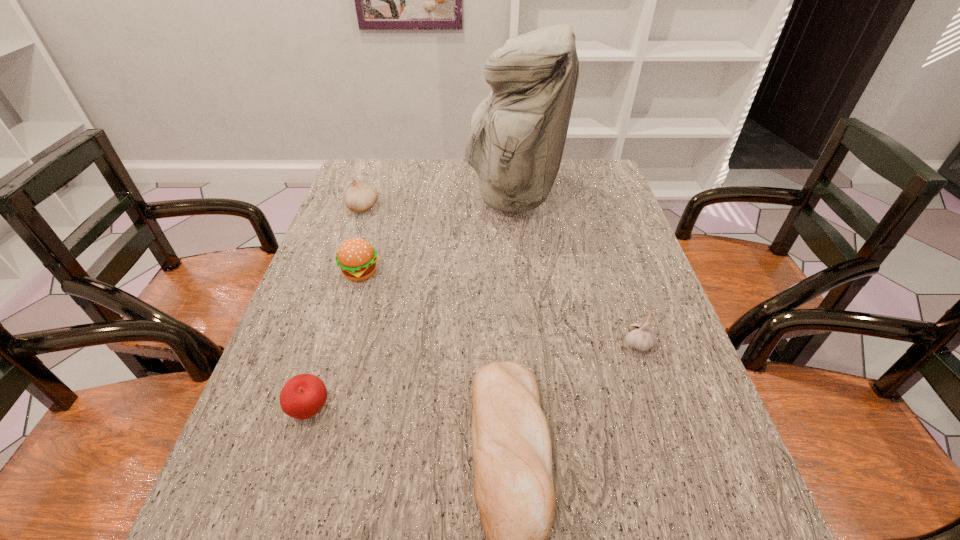
You are a GUI agent. You are given a task and a screenshot of the screen. Output one action in this format:
    pyautogui.click(x=<x>, y=<y>)
    Task: Click on the free location located on the back of the taller garlic
    This screenshot has height=540, width=960.
    Given the screenshot: What is the action you would take?
    pyautogui.click(x=369, y=190)

Find the location of a particular element. free region located on the back of the third farthest object is located at coordinates (381, 202).

You are a GUI agent. You are given a task and a screenshot of the screen. Output one action in this format:
    pyautogui.click(x=<x>, y=<y>)
    Task: Click on the vacant region located 0.090m on the back of the apple
    
    Given the screenshot: What is the action you would take?
    pyautogui.click(x=327, y=356)

Where is `vacant area located on the left of the third nearest object`? Image resolution: width=960 pixels, height=540 pixels. vacant area located on the left of the third nearest object is located at coordinates 533,344.

At what (x,y) coordinates should I click in order to perform the action: click on object that is positioned at the far edge. Please return your answer as a coordinate pair (x, y). This screenshot has width=960, height=540. Looking at the image, I should click on (517, 134).

Where is `garlic at the left edge`? Image resolution: width=960 pixels, height=540 pixels. garlic at the left edge is located at coordinates (359, 198).

At what (x,y) coordinates should I click in order to perform the action: click on hamburger present at the left edge. Please return your answer as a coordinate pair (x, y). Image resolution: width=960 pixels, height=540 pixels. Looking at the image, I should click on (357, 259).

Identify the location of apple located at the left edge. The height and width of the screenshot is (540, 960). (303, 396).

Find the location of a particular element. Image resolution: width=960 pixels, height=540 pixels. object located in the right edge section of the desktop is located at coordinates (640, 336).

Identify the location of free space at the far edge of the desktop. (435, 163).